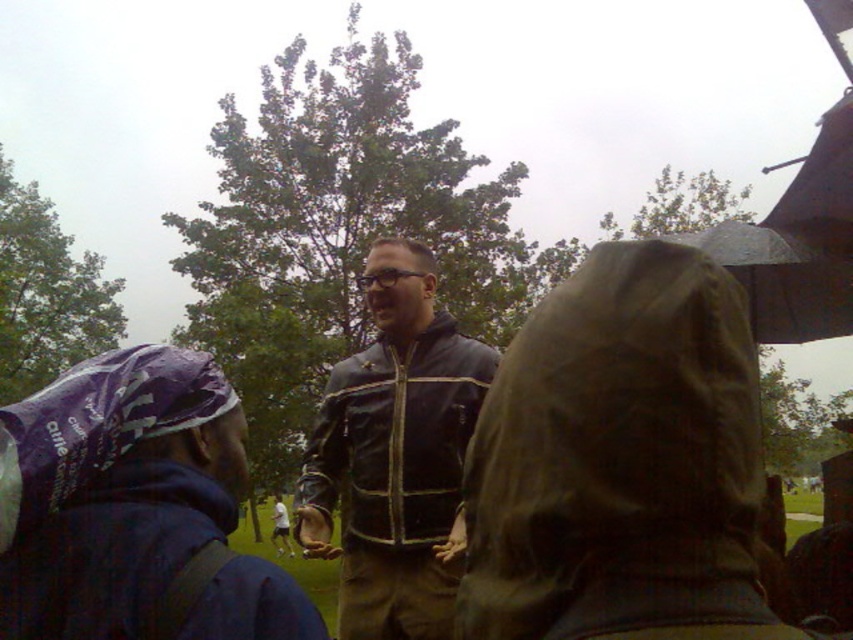
Looking at this image, you are a fashion designer observing the image. You need to decide which item to recommend for a slim fit design. Given the brown corduroy raincoat at center and the purple fabric bandana at left, which one has a slimmer profile?

The brown corduroy raincoat at center has a slimmer profile than the purple fabric bandana at left because it is thinner.

You are standing at the center of the image and want to move towards the point marked as point (134, 508). Which direction should you go?

The point (134, 508) is on the purple fabric bandana at left, so you should move to the left to reach it.

You are a photographer trying to capture a clear shot of the brown corduroy raincoat at center and the transparent plastic umbrella at upper right. Since the weather is overcast, you need to adjust your camera settings. Considering their sizes, which object should you focus on first if you want to ensure both are in focus without changing the focus distance?

The brown corduroy raincoat at center is thinner than the transparent plastic umbrella at upper right, so you should focus on the transparent plastic umbrella at upper right first because larger objects require focusing on their center to ensure sharpness throughout.